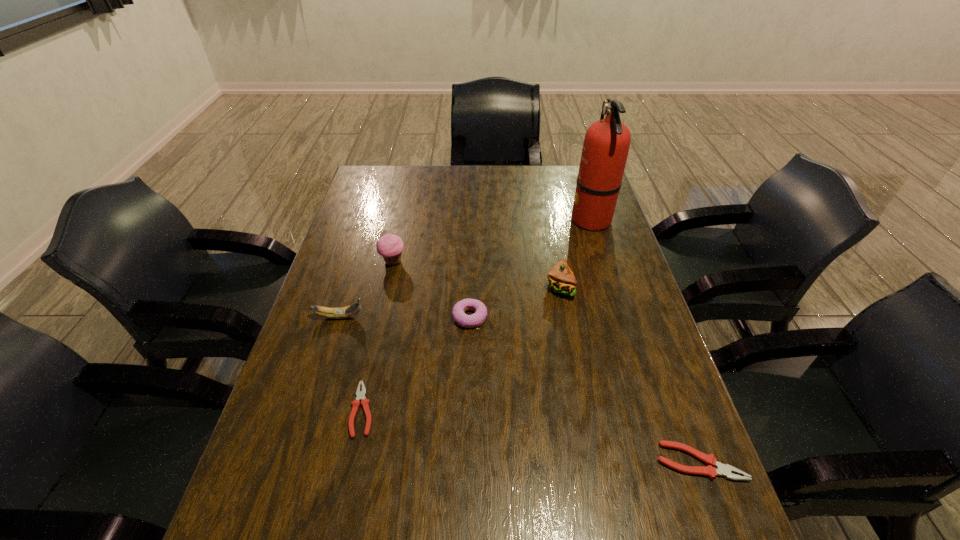
In order to click on the farther pliers in this screenshot , I will do `click(360, 395)`.

Locate an element on the screen. The image size is (960, 540). the left pliers is located at coordinates (360, 395).

You are a GUI agent. You are given a task and a screenshot of the screen. Output one action in this format:
    pyautogui.click(x=<x>, y=<y>)
    Task: Click on the second shortest object
    
    Given the screenshot: What is the action you would take?
    pyautogui.click(x=723, y=470)

This screenshot has height=540, width=960. Find the location of `the taller pliers`. the taller pliers is located at coordinates (723, 470).

The image size is (960, 540). I want to click on cupcake, so click(390, 246).

Identify the location of the fifth object from left to right. This screenshot has width=960, height=540. (561, 279).

Identify the location of sandwich. (561, 279).

Where is `fire extinguisher`? fire extinguisher is located at coordinates (606, 145).

What are the coordinates of `the tallest object` in the screenshot? It's located at (606, 145).

Find the location of `the fourth object from left to right`. the fourth object from left to right is located at coordinates 476,319.